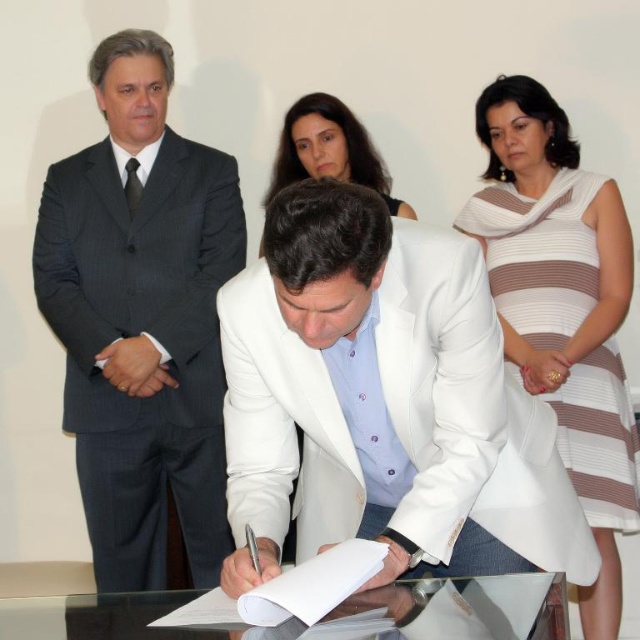
Who is more distant from viewer, (x=182, y=596) or (x=404, y=202)?

The point (x=404, y=202) is behind.

Identify the location of transparent glass table at center. (102, 618).

Identify the location of transparent glass table at center. (102, 618).

Based on the photo, is white matte jacket at center to the left of transparent glass table at center from the viewer's perspective?

No, white matte jacket at center is not to the left of transparent glass table at center.

Between point (388, 572) and point (90, 612), which one is positioned in front?

Positioned in front is point (388, 572).

Describe the element at coordinates (384, 403) in the screenshot. This screenshot has height=640, width=640. I see `white matte jacket at center` at that location.

At what (x,y) coordinates should I click in order to perform the action: click on white matte jacket at center. Please return your answer as a coordinate pair (x, y). The height and width of the screenshot is (640, 640). Looking at the image, I should click on point(384,403).

Is white matte jacket at center bigger than dark gray pinstripe suit at left?

Actually, white matte jacket at center might be smaller than dark gray pinstripe suit at left.

Between point (312, 493) and point (93, 365), which one is positioned in front?

Point (312, 493)

Find the location of a particular element. white matte jacket at center is located at coordinates (384, 403).